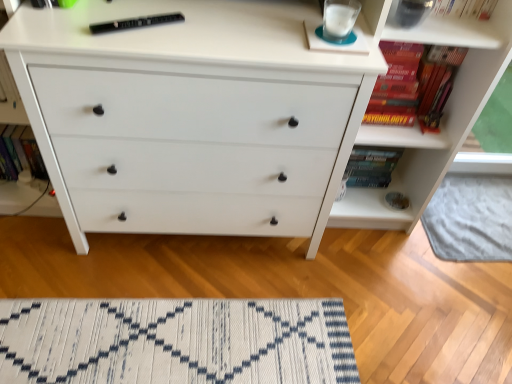
The image size is (512, 384). In order to click on vacant area that lies to the right of white matte chest of drawers at center in this screenshot , I will do `click(370, 288)`.